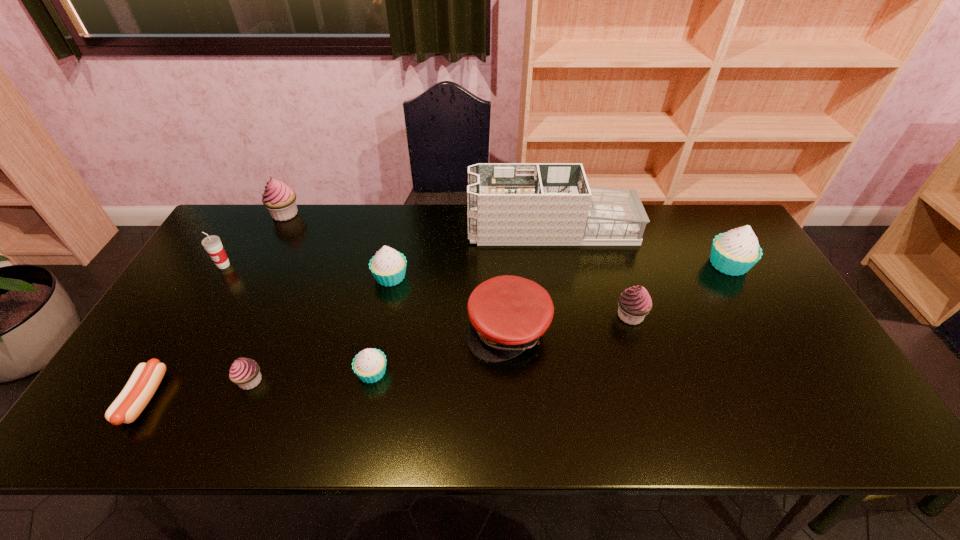
Where is `cup that is at the left edge`? This screenshot has height=540, width=960. cup that is at the left edge is located at coordinates coord(212,244).

Locate an element on the screen. sausage that is positioned at the left edge is located at coordinates (144, 381).

The height and width of the screenshot is (540, 960). Find the location of `object that is positioned at the right edge`. object that is positioned at the right edge is located at coordinates (735, 252).

The width and height of the screenshot is (960, 540). I want to click on object situated at the far left corner, so click(280, 199).

Locate an element on the screen. object located at the near left corner is located at coordinates (144, 381).

At what (x,y) coordinates should I click in order to perform the action: click on object that is at the far right corner. Please return your answer as a coordinate pair (x, y). Looking at the image, I should click on (735, 252).

The height and width of the screenshot is (540, 960). I want to click on free region at the far edge of the desktop, so click(x=400, y=219).

At what (x,y) coordinates should I click in order to perform the action: click on vacant space at the near edge. Please return your answer as a coordinate pair (x, y). Image resolution: width=960 pixels, height=540 pixels. Looking at the image, I should click on (772, 436).

The height and width of the screenshot is (540, 960). In the image, there is a desktop. Find the location of `vacant space at the left edge`. vacant space at the left edge is located at coordinates (191, 333).

Find the location of a particular element. free location at the far left corner of the desktop is located at coordinates (243, 247).